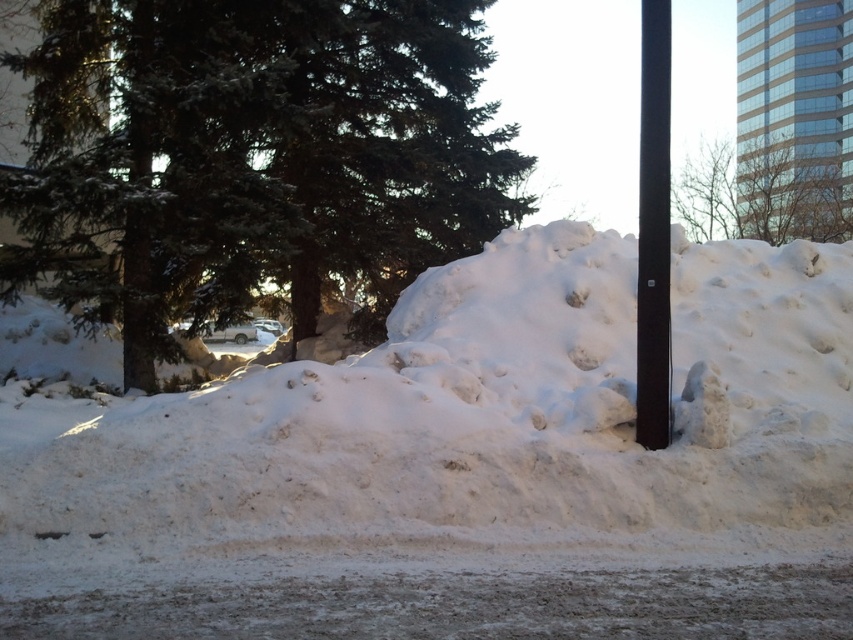
Between white fluffy snow at center and black smooth pole at right, which one has less height?

white fluffy snow at center

Can you confirm if white fluffy snow at center is positioned to the right of black smooth pole at right?

In fact, white fluffy snow at center is to the left of black smooth pole at right.

Identify the location of white fluffy snow at center. (469, 467).

Which is behind, point (173, 243) or point (639, 413)?

The point (173, 243) is behind.

Which is in front, point (244, 58) or point (645, 248)?

Positioned in front is point (645, 248).

Who is more forward, (206, 291) or (660, 170)?

Point (660, 170) is in front.

The height and width of the screenshot is (640, 853). Find the location of `green textured pine at upper left`. green textured pine at upper left is located at coordinates (251, 157).

In the scene shown: Between white fluffy snow at center and green textured pine at upper left, which one has more height?

With more height is green textured pine at upper left.

Is white fluffy snow at center taller than green textured pine at upper left?

In fact, white fluffy snow at center may be shorter than green textured pine at upper left.

This screenshot has width=853, height=640. I want to click on white fluffy snow at center, so click(469, 467).